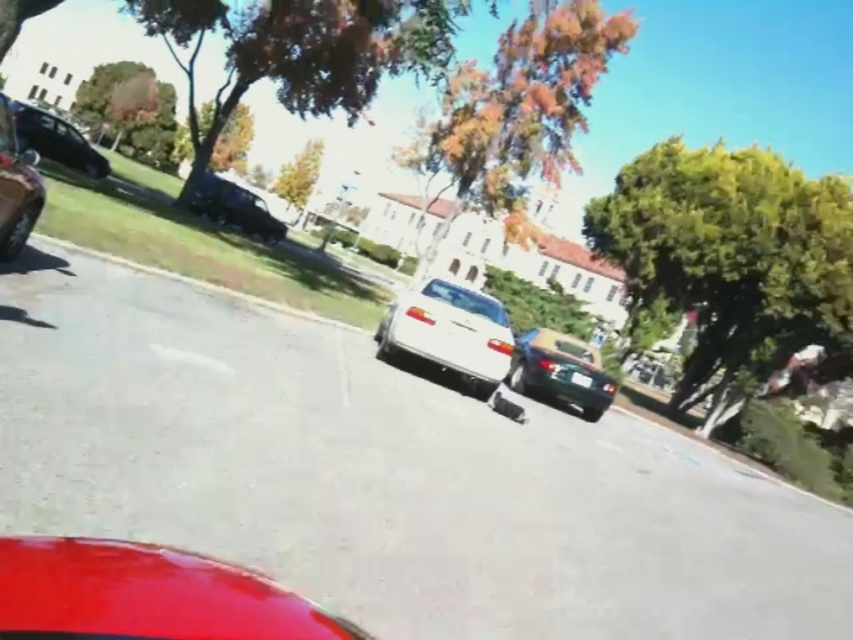
You are driving a car and looking at the road ahead. You see the gray asphalt curb at lower center and the black plastic license plate at center. Which object is positioned higher in the image?

The gray asphalt curb at lower center is positioned higher than the black plastic license plate at center in the image.